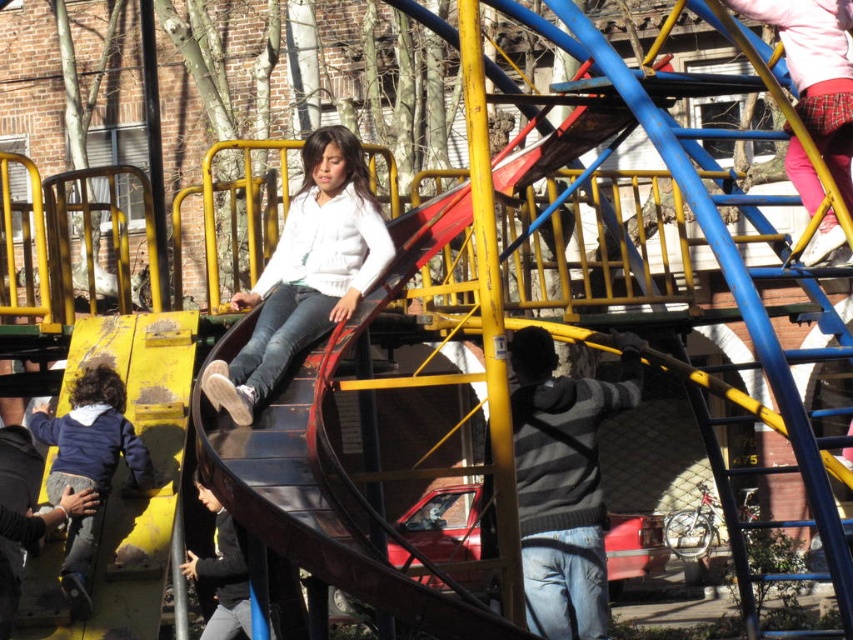
Is point (289, 291) more distant than point (111, 476)?

Yes, point (289, 291) is farther from viewer.

Which is behind, point (213, 400) or point (107, 476)?

The point (107, 476) is behind.

Where is `white matte sweater at center`? The height and width of the screenshot is (640, 853). white matte sweater at center is located at coordinates (306, 273).

Is dark blue fleece jacket at lower left below dark gray sweater at center?

No, dark blue fleece jacket at lower left is not below dark gray sweater at center.

The height and width of the screenshot is (640, 853). In order to click on dark blue fleece jacket at lower left in this screenshot , I will do `click(88, 467)`.

Based on the photo, does white matte sweater at center appear on the right side of dark gray sweater at center?

Correct, you'll find white matte sweater at center to the right of dark gray sweater at center.

Can you confirm if white matte sweater at center is bigger than dark gray sweater at center?

No, white matte sweater at center is not bigger than dark gray sweater at center.

Which is in front, point (287, 212) or point (233, 536)?

Point (287, 212) is more forward.

Identify the location of white matte sweater at center. (306, 273).